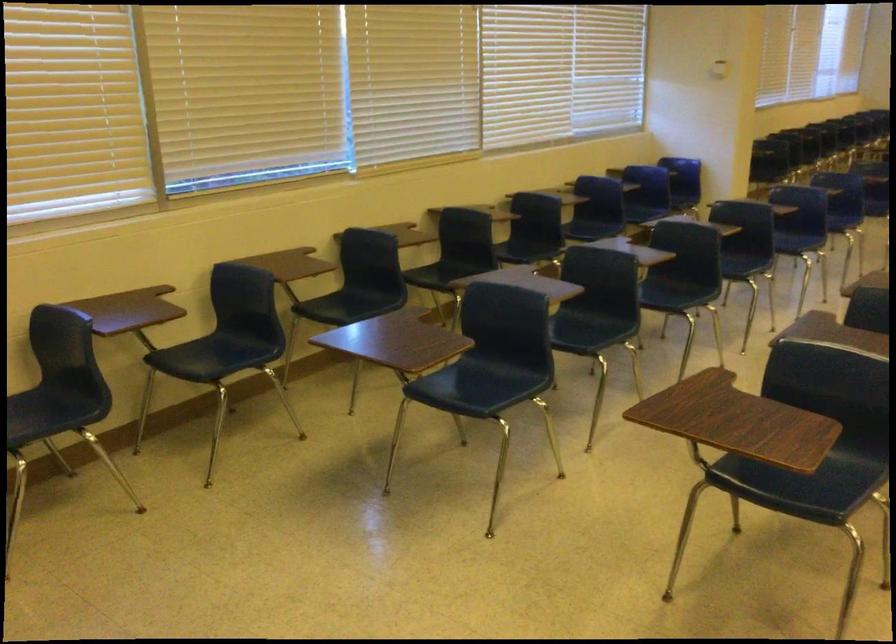
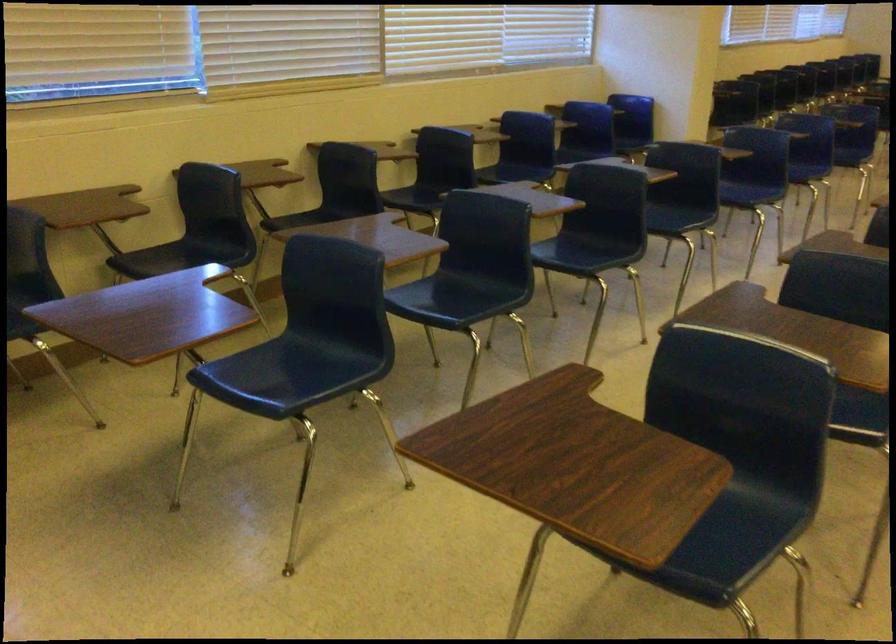
Question: The first image is from the beginning of the video and the second image is from the end. How did the camera likely rotate when shooting the video?

Choices:
 (A) Left
 (B) Right
 (C) Up
 (D) Down

Answer: (D)